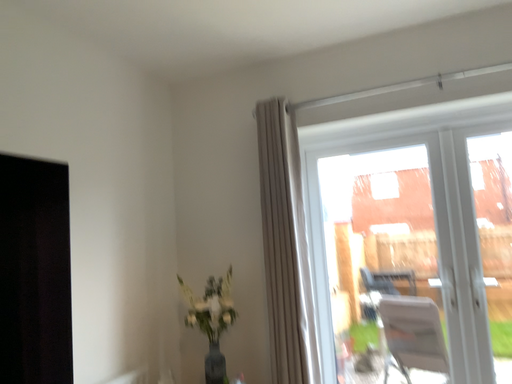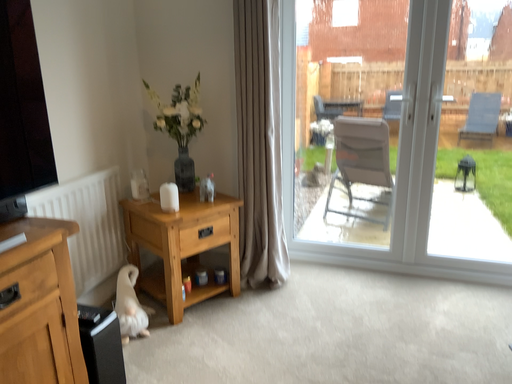
Question: Which way did the camera rotate in the video?

Choices:
 (A) rotated downward
 (B) rotated upward

Answer: (A)